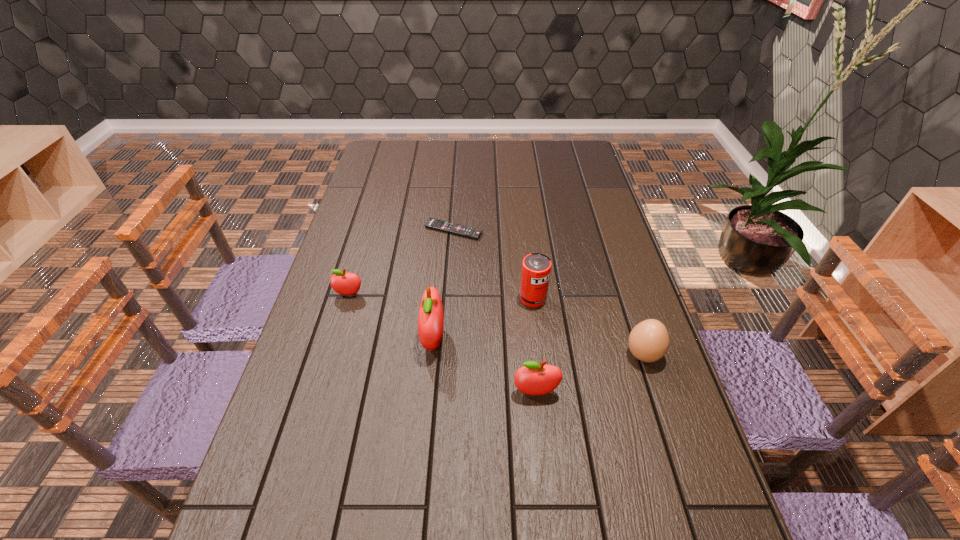
Where is `empty space between the rightmost apple and the second apple from right to left`? This screenshot has width=960, height=540. empty space between the rightmost apple and the second apple from right to left is located at coordinates (485, 366).

The image size is (960, 540). Find the location of `vacant region between the remote control and the tallest object`. vacant region between the remote control and the tallest object is located at coordinates (444, 285).

At what (x,y) coordinates should I click in order to perform the action: click on vacant area that lies between the rightmost object and the can. Please return your answer as a coordinate pair (x, y). The height and width of the screenshot is (540, 960). Looking at the image, I should click on (588, 327).

Locate an element on the screen. free space between the leftmost apple and the shortest object is located at coordinates (401, 262).

I want to click on unoccupied position between the rightmost object and the fifth tallest object, so click(x=496, y=325).

Locate an element on the screen. the third closest object relative to the second farthest apple is located at coordinates (536, 268).

This screenshot has height=540, width=960. What are the coordinates of `the second closest object to the shortest apple` in the screenshot? It's located at (461, 230).

Point out which apple is positioned as the nearest to the leftmost apple. Please provide its 2D coordinates. Your answer should be formatted as a tuple, i.e. [(x, y)], where the tuple contains the x and y coordinates of a point satisfying the conditions above.

[(431, 317)]

I want to click on apple that is the second closest to the second apple from right to left, so click(x=343, y=283).